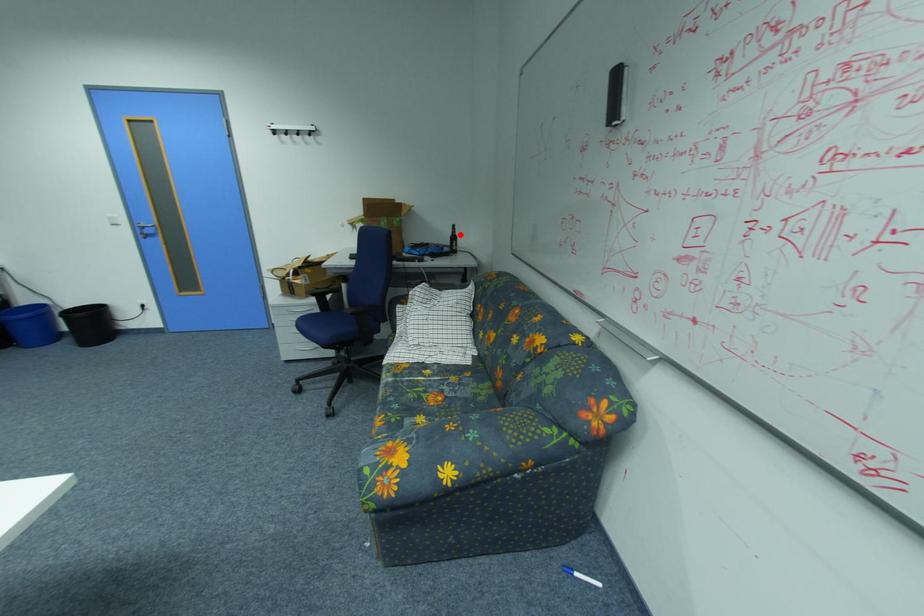
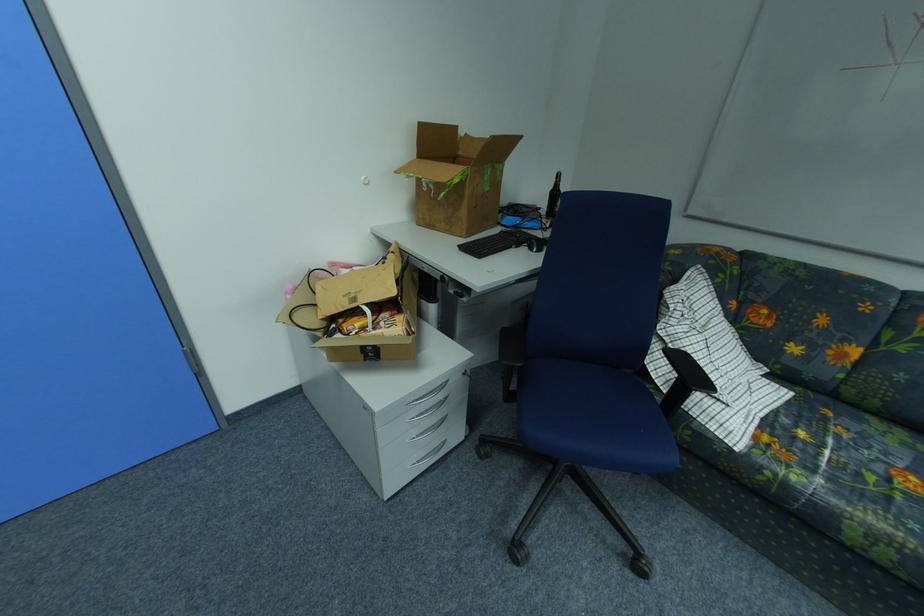
Find the pixel in the second image that matches the highlighted location in the first image.

(560, 188)